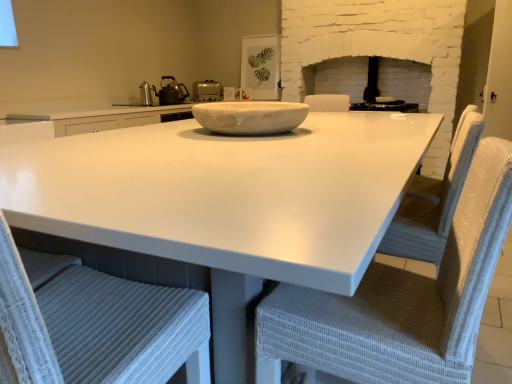
Question: Is white wicker chair at center, placed as the first chair when sorted from right to left, aimed at white marble bowl at center?

Choices:
 (A) no
 (B) yes

Answer: (A)

Question: Does white wicker chair at center, placed as the first chair when sorted from right to left, appear on the left side of white marble bowl at center?

Choices:
 (A) no
 (B) yes

Answer: (A)

Question: Considering the relative sizes of white wicker chair at center, placed as the first chair when sorted from right to left, and white marble bowl at center in the image provided, is white wicker chair at center, placed as the first chair when sorted from right to left, thinner than white marble bowl at center?

Choices:
 (A) no
 (B) yes

Answer: (B)

Question: Can you confirm if white wicker chair at center, positioned as the second chair in left-to-right order, is smaller than white marble bowl at center?

Choices:
 (A) no
 (B) yes

Answer: (A)

Question: Does white wicker chair at center, placed as the first chair when sorted from right to left, have a greater height compared to white marble bowl at center?

Choices:
 (A) no
 (B) yes

Answer: (B)

Question: Would you say white glossy countertop at center is inside or outside black plastic toaster at upper center?

Choices:
 (A) inside
 (B) outside

Answer: (B)

Question: From the image's perspective, is white glossy countertop at center positioned above or below black plastic toaster at upper center?

Choices:
 (A) below
 (B) above

Answer: (A)

Question: Considering their positions, is white glossy countertop at center located in front of or behind black plastic toaster at upper center?

Choices:
 (A) front
 (B) behind

Answer: (A)

Question: Is point (11, 183) closer or farther from the camera than point (407, 105)?

Choices:
 (A) farther
 (B) closer

Answer: (B)

Question: Considering their positions, is white matte toaster at upper center located in front of or behind white wicker chair at lower left, the second chair in the right-to-left sequence?

Choices:
 (A) front
 (B) behind

Answer: (B)

Question: Looking at the image, does white matte toaster at upper center seem bigger or smaller compared to white wicker chair at lower left, acting as the 1th chair starting from the left?

Choices:
 (A) small
 (B) big

Answer: (A)

Question: From a real-world perspective, is white matte toaster at upper center positioned above or below white wicker chair at lower left, acting as the 1th chair starting from the left?

Choices:
 (A) above
 (B) below

Answer: (A)

Question: In terms of width, does white matte toaster at upper center look wider or thinner when compared to white wicker chair at lower left, acting as the 1th chair starting from the left?

Choices:
 (A) thin
 (B) wide

Answer: (A)

Question: From the image's perspective, is white wicker chair at center, positioned as the second chair in left-to-right order, located above or below white glossy countertop at center?

Choices:
 (A) above
 (B) below

Answer: (B)

Question: Is white wicker chair at center, positioned as the second chair in left-to-right order, spatially inside white glossy countertop at center, or outside of it?

Choices:
 (A) outside
 (B) inside

Answer: (B)